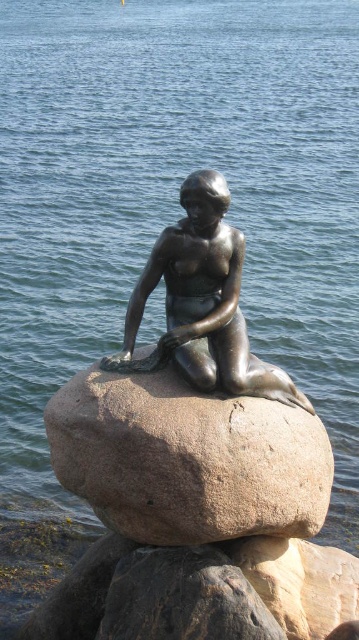
You are standing in a park and see the brown granite rock at center. If you want to reach the rock within 10 seconds, what is the minimum speed you need to walk towards it?

The brown granite rock at center is 31.83 meters away. To reach it in 10 seconds, you need to walk at a minimum speed of 3.183 meters per second.

You are an artist trying to sketch the scene. You need to place the brown granite rock at center in your drawing. According to the coordinates provided, where should you position it on your paper?

The brown granite rock at center should be positioned at coordinates point (188,460) as specified in the description.

You are an art curator planning to install a protective glass case around the bronze statue at center and the brown granite rock at center. Based on their sizes, which object should be placed closer to the front of the case to ensure both are fully visible?

The brown granite rock at center is not as tall as the bronze statue at center, so the bronze statue at center should be placed closer to the front of the case to ensure both are fully visible.